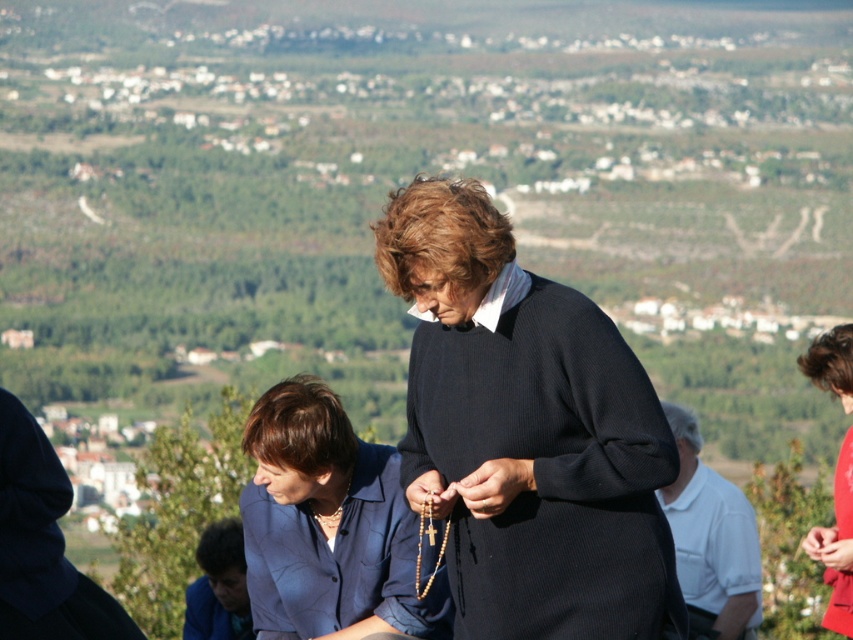
You are a photographer trying to capture the blue fabric blouse at lower center in your shot. Based on the scene description, what are the exact coordinates where you should focus your camera?

The exact coordinates to focus on are point (328, 525) as specified in the description.

You are organizing a photo shoot and need to know which object takes up more area in the image. Based on the scene description, which object between the blue fabric blouse at lower center and the matte red coat at center is larger in size?

The matte red coat at center occupies more space than the blue fabric blouse at lower center, so the matte red coat at center is larger in size.